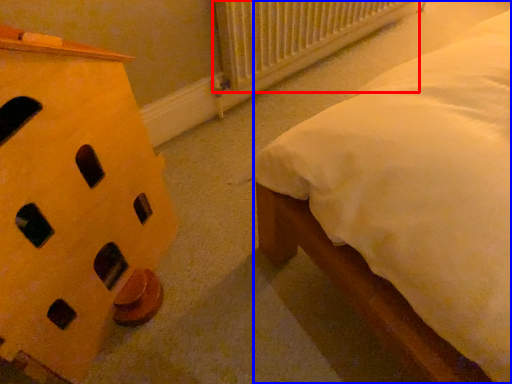
Question: Which of the following is the closest to the observer, radiator (highlighted by a red box) or nightstand (highlighted by a blue box)?

Choices:
 (A) radiator
 (B) nightstand

Answer: (B)